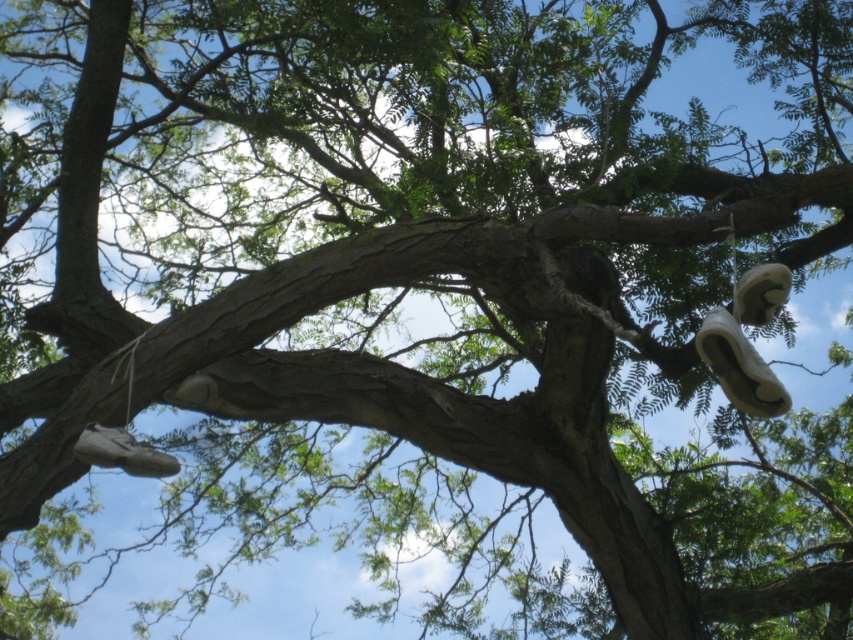
You are a photographer trying to capture both the white matte shoe at upper right and the white matte shoe at lower left in a single frame. Which shoe will appear smaller in the photo?

The white matte shoe at upper right will appear smaller in the photo because it is smaller than the white matte shoe at lower left.

You are a delivery person trying to reach the white matte shoe at lower left and the white suede shoe at upper right to deliver a package. Which shoe is closer to the ground?

The white matte shoe at lower left is closer to the ground since it is positioned at lower left compared to the white suede shoe at upper right.

You are standing in front of the tree with sneakers hanging from its branches. There are two points marked on the tree trunk. One is at coordinates point (753, 369) and the other at point (755, 276). Which point is closer to you?

Point (753, 369) is in front of point (755, 276), so it is closer to you.